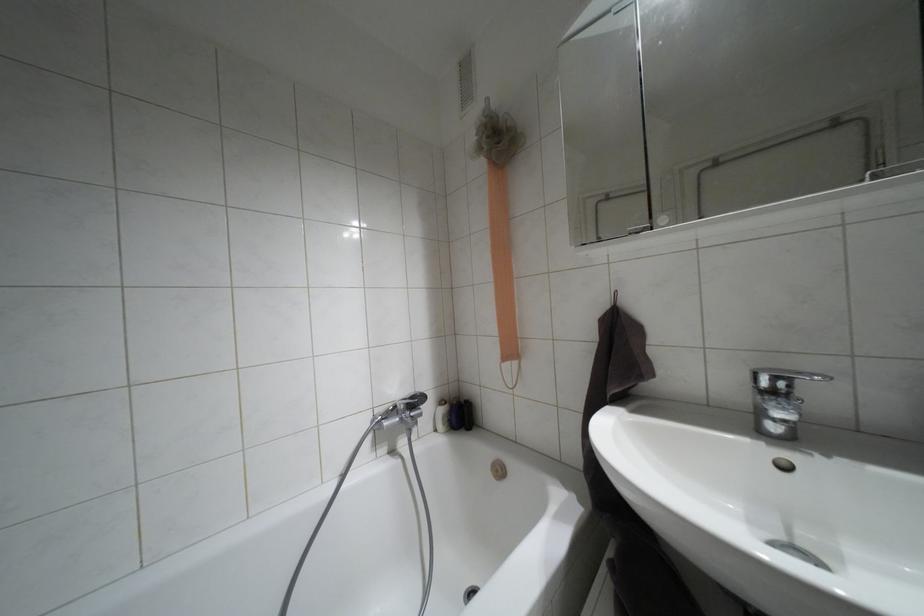
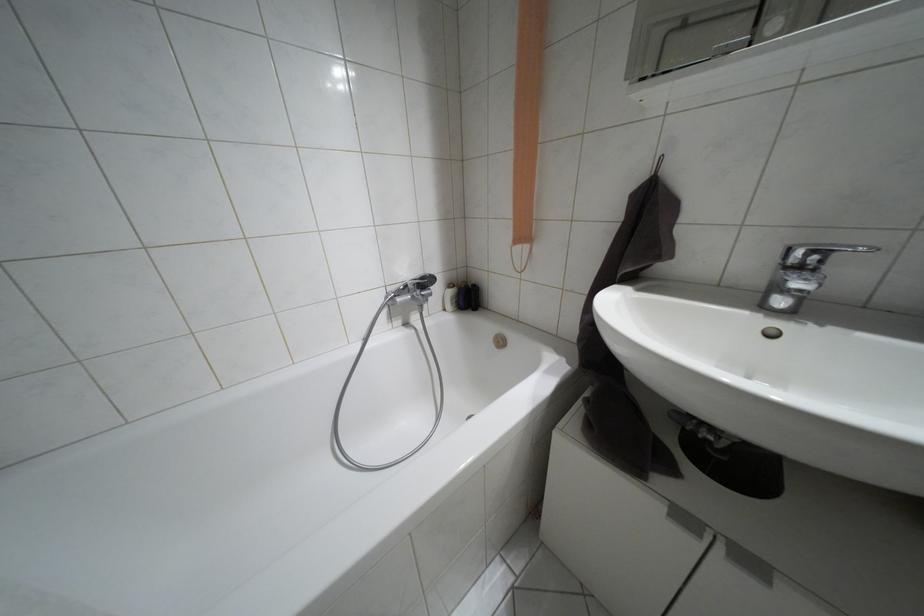
The point at (x=441, y=400) is marked in the first image. Where is the corresponding point in the second image?

(448, 285)